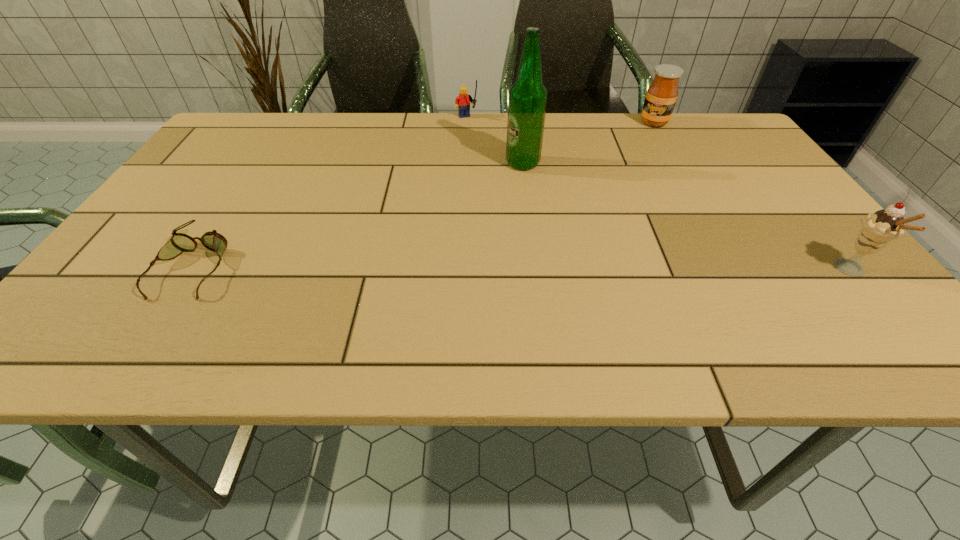
I want to click on spectacles, so click(x=179, y=242).

At what (x,y) coordinates should I click in order to perform the action: click on the shortest object. Please return your answer as a coordinate pair (x, y). This screenshot has height=540, width=960. Looking at the image, I should click on (179, 242).

The height and width of the screenshot is (540, 960). In order to click on icecream in this screenshot , I will do `click(879, 228)`.

Identify the location of beer bottle. point(527,101).

Find the location of a particular element. the third object from left to right is located at coordinates (527, 101).

You are a GUI agent. You are given a task and a screenshot of the screen. Output one action in this format:
    pyautogui.click(x=<x>, y=<y>)
    Task: Click on the second shortest object
    
    Given the screenshot: What is the action you would take?
    pyautogui.click(x=462, y=102)

Image resolution: width=960 pixels, height=540 pixels. In order to click on Lego in this screenshot , I will do `click(462, 102)`.

Where is `honey`? The image size is (960, 540). honey is located at coordinates (661, 97).

Locate an element on the screen. The width and height of the screenshot is (960, 540). the third shortest object is located at coordinates (661, 97).

Find the location of a particular element. This screenshot has width=960, height=540. vacant space located on the back of the icecream is located at coordinates [815, 227].